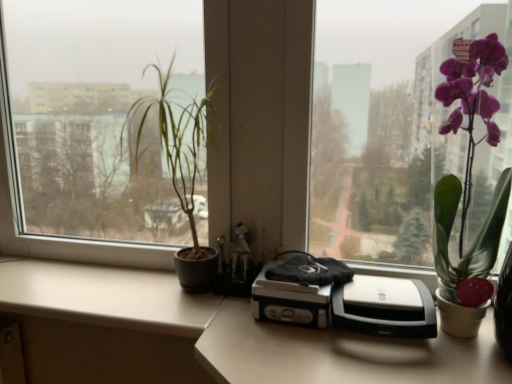
You are a GUI agent. You are given a task and a screenshot of the screen. Output one action in this format:
    pyautogui.click(x=<x>, y=<y>)
    Task: Click on the vacant space underneath green matte plant at left, which is the second houseplant from right to left (from a real-world perspective)
    
    Given the screenshot: What is the action you would take?
    pyautogui.click(x=178, y=295)